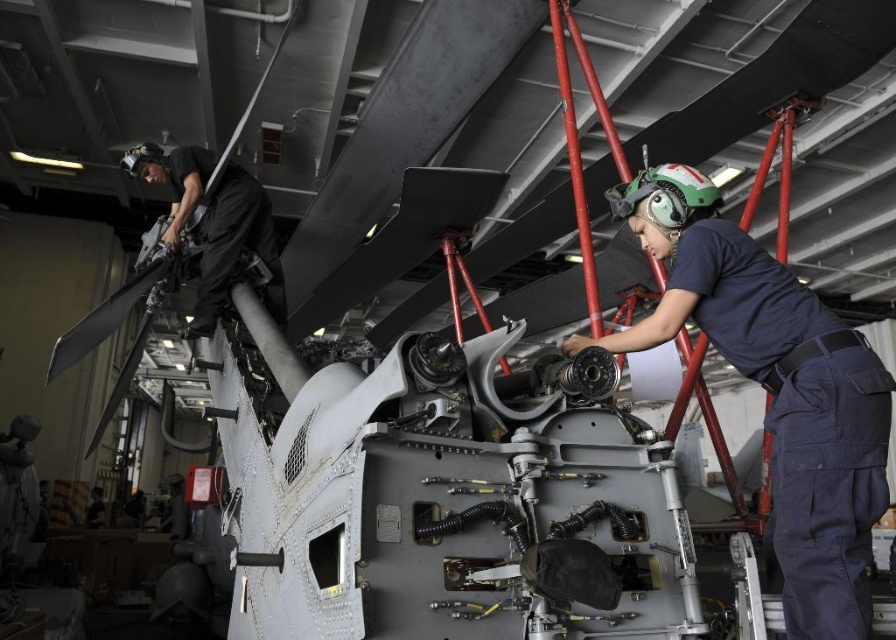
You are an observer in the hangar. You see the navy blue uniform at center and the black fabric helmet at upper left. Which object is positioned lower in the scene?

The navy blue uniform at center is located below the black fabric helmet at upper left, so the navy blue uniform at center is positioned lower in the scene.

You are a maintenance worker in the hangar and need to reach the black fabric helmet at upper left from your current position near the navy blue uniform at center. Is the distance between them sufficient for you to comfortably walk without needing to move any obstacles?

The navy blue uniform at center and black fabric helmet at upper left are 7.75 feet apart. Since 7.75 feet is a reasonable distance for walking, you can comfortably walk to the helmet without needing to move obstacles.

You are an inspector in the hangar and need to determine if the navy blue uniform at center can fit into a storage locker designed for items smaller than the black fabric helmet at upper left. Can it fit?

The navy blue uniform at center has a smaller size compared to the black fabric helmet at upper left, so it can fit into the storage locker designed for items smaller than the black fabric helmet at upper left.